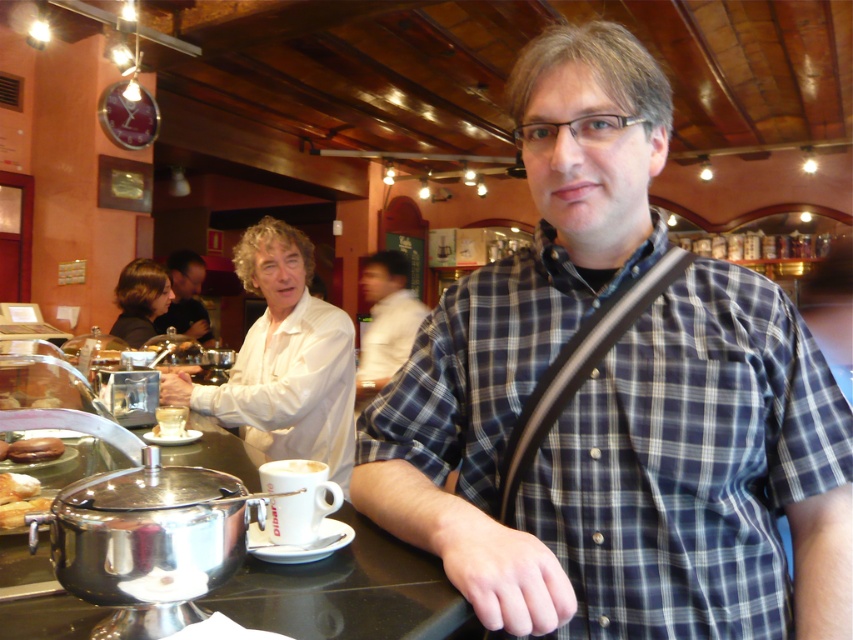
Question: Can you confirm if white matte shirt at upper center is positioned above white bread at center?

Choices:
 (A) no
 (B) yes

Answer: (B)

Question: Which object is closer to the camera taking this photo?

Choices:
 (A) golden brown bread at lower left
 (B) white matte cup at center
 (C) blue plaid shirt at center
 (D) brown matte pastry at lower left

Answer: (C)

Question: Estimate the real-world distances between objects in this image. Which object is closer to the brown matte pastry at lower left?

Choices:
 (A) white matte shirt at upper center
 (B) light brown leather jacket at center

Answer: (A)

Question: In this image, where is white matte shirt at center located relative to white bread at center?

Choices:
 (A) left
 (B) right

Answer: (B)

Question: Among these points, which one is farthest from the camera?

Choices:
 (A) (190, 285)
 (B) (392, 337)
 (C) (286, 296)
 (D) (6, 452)

Answer: (A)

Question: Considering the relative positions of white matte shirt at upper center and white bread at center in the image provided, where is white matte shirt at upper center located with respect to white bread at center?

Choices:
 (A) below
 (B) above

Answer: (B)